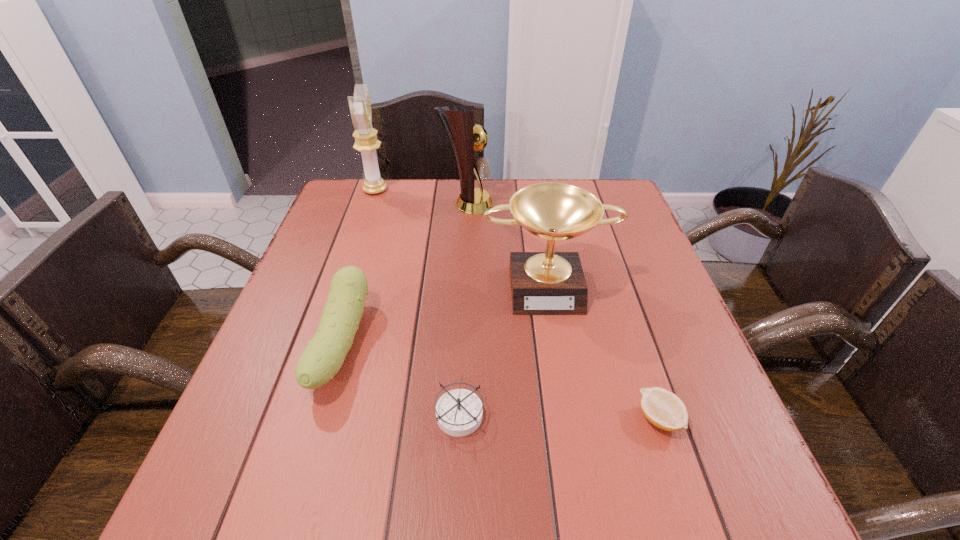
The image size is (960, 540). In the image, there is a desktop. Identify the location of vacant space at the far left corner. (382, 205).

Find the location of a particular element. vacant space at the far right corner of the desktop is located at coordinates (571, 181).

This screenshot has width=960, height=540. What are the coordinates of `free spot at the near right corner of the desktop` in the screenshot? It's located at (766, 528).

Identify the location of free space between the cucumber and the shortest object. (500, 382).

Identify the location of vacant space that is in between the third tallest object and the cucumber. (444, 314).

Locate an element on the screen. free space between the fourth shortest object and the shortest object is located at coordinates (603, 352).

The width and height of the screenshot is (960, 540). In order to click on empty space that is in between the leftmost award and the cucumber in this screenshot , I will do `click(358, 267)`.

Locate an element on the screen. This screenshot has width=960, height=540. free space between the second shortest object and the shortest object is located at coordinates (559, 416).

Where is `vacant space that is in between the fifth tallest object and the third tallest object`? vacant space that is in between the fifth tallest object and the third tallest object is located at coordinates (503, 349).

The width and height of the screenshot is (960, 540). What are the coordinates of `object that is the closest to the compass` in the screenshot? It's located at (321, 360).